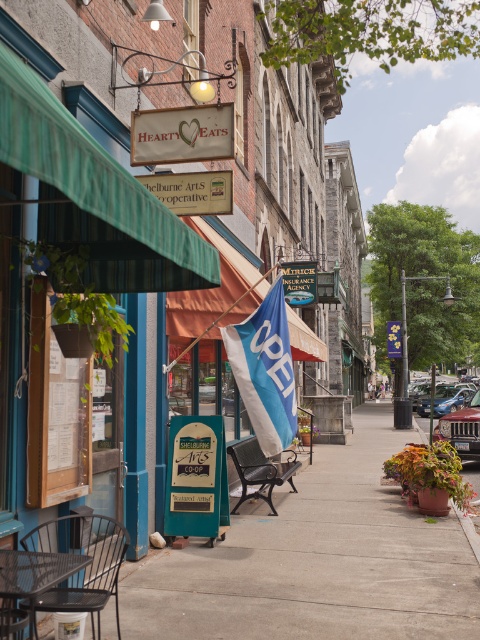
Question: Does green striped awning at upper left have a larger size compared to blue fabric flag at center?

Choices:
 (A) yes
 (B) no

Answer: (A)

Question: Among these objects, which one is farthest from the camera?

Choices:
 (A) black wrought iron bench at center
 (B) wooden menu at left
 (C) green striped awning at upper left
 (D) concrete sidewalk at center

Answer: (A)

Question: Does concrete sidewalk at center lie in front of blue fabric flag at center?

Choices:
 (A) yes
 (B) no

Answer: (A)

Question: Which point is farther to the camera?

Choices:
 (A) wooden menu at left
 (B) blue fabric flag at center

Answer: (B)

Question: Can you confirm if concrete sidewalk at center is bigger than blue fabric flag at center?

Choices:
 (A) no
 (B) yes

Answer: (B)

Question: Which point is farther from the camera taking this photo?

Choices:
 (A) (267, 465)
 (B) (95, 195)

Answer: (A)